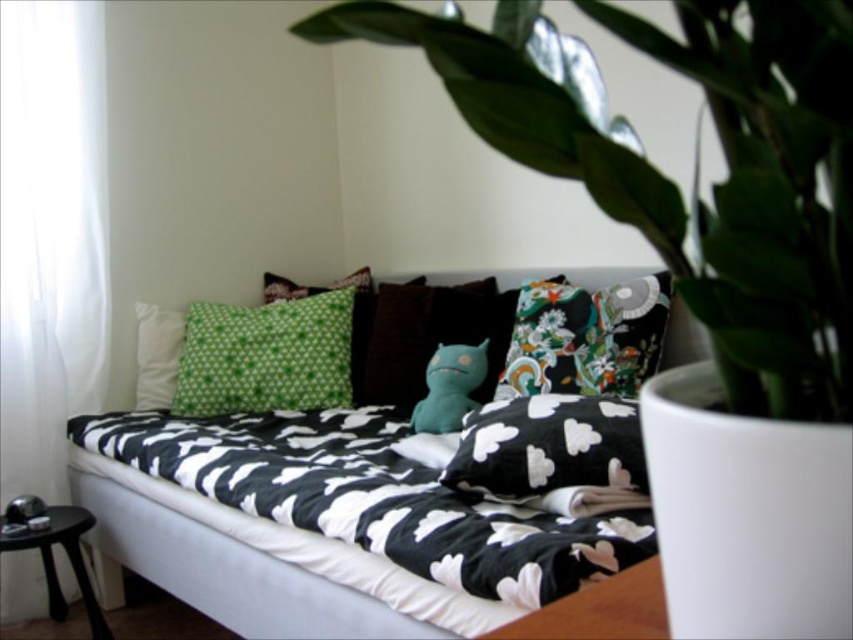
Is black cotton pillow at center thinner than white soft pillow at upper left?

No, black cotton pillow at center is not thinner than white soft pillow at upper left.

Find the location of a particular element. black cotton pillow at center is located at coordinates (548, 445).

Which is behind, point (0, 172) or point (389, 314)?

Point (389, 314)

The height and width of the screenshot is (640, 853). Find the location of `white sheer curtain at left`. white sheer curtain at left is located at coordinates tap(50, 236).

Can you confirm if teal plush toy at center is taller than black glossy stool at lower left?

Indeed, teal plush toy at center has a greater height compared to black glossy stool at lower left.

Who is more distant from viewer, (409, 285) or (57, 524)?

The point (409, 285) is more distant.

This screenshot has width=853, height=640. Describe the element at coordinates (428, 337) in the screenshot. I see `teal plush toy at center` at that location.

Where is `teal plush toy at center`? The height and width of the screenshot is (640, 853). teal plush toy at center is located at coordinates (428, 337).